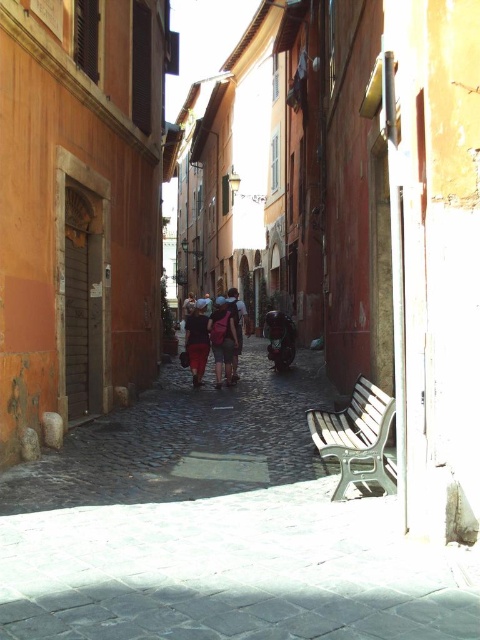
Is the position of matte black backpack at center more distant than that of dark blue fabric at center?

No, matte black backpack at center is in front of dark blue fabric at center.

Which is below, matte black backpack at center or dark blue fabric at center?

matte black backpack at center is lower down.

Identify the location of matte black backpack at center. Image resolution: width=480 pixels, height=640 pixels. point(225,337).

At what (x,y) coordinates should I click in order to perform the action: click on matte black backpack at center. Please return your answer as a coordinate pair (x, y). Looking at the image, I should click on (225, 337).

Does dark brown leather backpack at center appear under dark blue fabric at center?

Correct, dark brown leather backpack at center is located below dark blue fabric at center.

At what (x,y) coordinates should I click in order to perform the action: click on dark brown leather backpack at center. Please return your answer as a coordinate pair (x, y). The image size is (480, 640). Looking at the image, I should click on (196, 340).

What do you see at coordinates (357, 438) in the screenshot? The height and width of the screenshot is (640, 480). I see `white plastic bench at lower right` at bounding box center [357, 438].

Does white plastic bench at lower right have a larger size compared to green fabric baby carriage at center?

Yes, white plastic bench at lower right is bigger than green fabric baby carriage at center.

Is point (347, 483) farther from camera compared to point (272, 317)?

No.

Locate an element on the screen. Image resolution: width=480 pixels, height=640 pixels. white plastic bench at lower right is located at coordinates (357, 438).